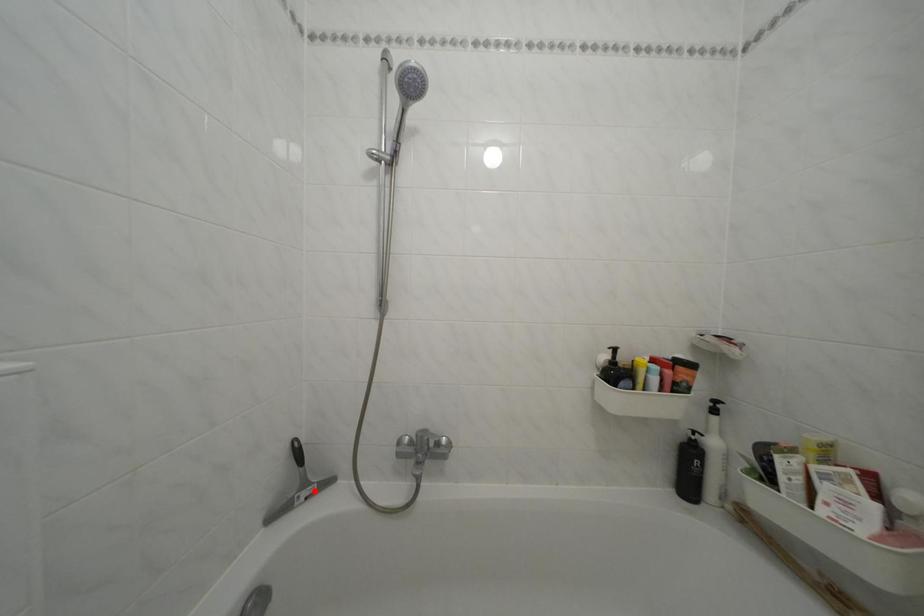
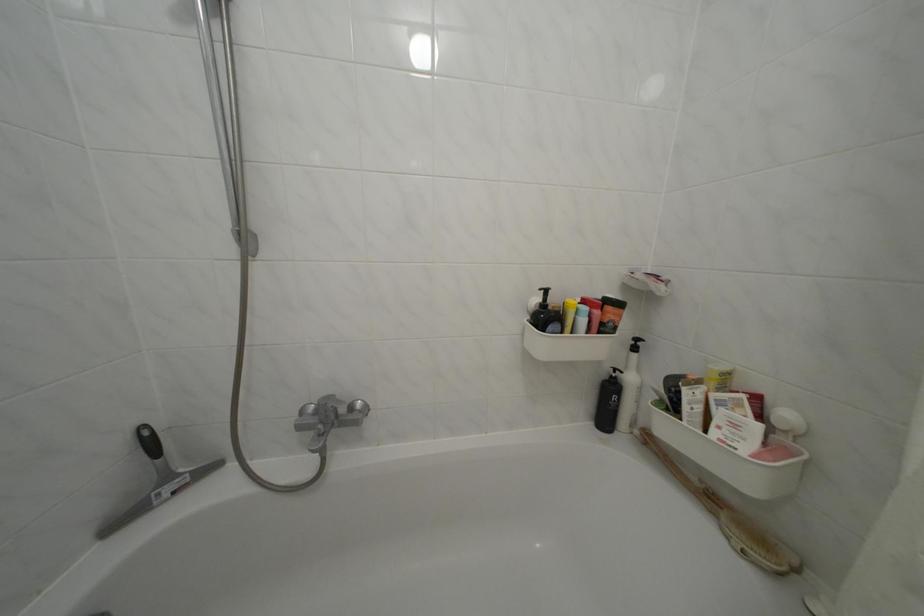
In the second image, find the point that corresponds to the highlighted location in the first image.

(176, 484)